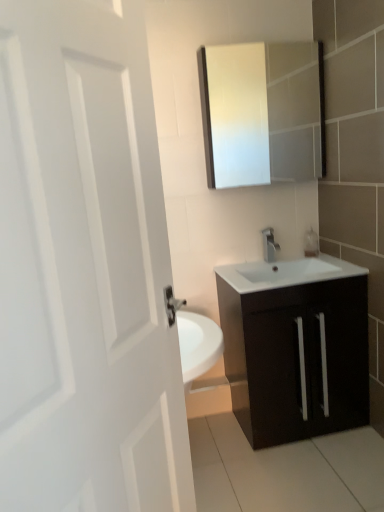
Question: From a real-world perspective, is matte dark wood cabinet at lower right beneath clear glass soap dispenser at right?

Choices:
 (A) no
 (B) yes

Answer: (B)

Question: Is matte dark wood cabinet at lower right thinner than clear glass soap dispenser at right?

Choices:
 (A) yes
 (B) no

Answer: (B)

Question: Is matte dark wood cabinet at lower right facing away from clear glass soap dispenser at right?

Choices:
 (A) yes
 (B) no

Answer: (B)

Question: Is matte dark wood cabinet at lower right surrounding clear glass soap dispenser at right?

Choices:
 (A) yes
 (B) no

Answer: (B)

Question: Can you confirm if matte dark wood cabinet at lower right is shorter than clear glass soap dispenser at right?

Choices:
 (A) yes
 (B) no

Answer: (B)

Question: From their relative heights in the image, would you say white matte door at left is taller or shorter than matte dark wood cabinet at lower right?

Choices:
 (A) tall
 (B) short

Answer: (A)

Question: From a real-world perspective, is white matte door at left positioned above or below matte dark wood cabinet at lower right?

Choices:
 (A) below
 (B) above

Answer: (B)

Question: From the image's perspective, is white matte door at left above or below matte dark wood cabinet at lower right?

Choices:
 (A) above
 (B) below

Answer: (A)

Question: Based on their positions, is white matte door at left located to the left or right of matte dark wood cabinet at lower right?

Choices:
 (A) right
 (B) left

Answer: (B)

Question: Visually, is white matte door at left positioned to the left or to the right of clear glass soap dispenser at right?

Choices:
 (A) left
 (B) right

Answer: (A)

Question: Is white matte door at left taller or shorter than clear glass soap dispenser at right?

Choices:
 (A) short
 (B) tall

Answer: (B)

Question: Considering the positions of white matte door at left and clear glass soap dispenser at right in the image, is white matte door at left wider or thinner than clear glass soap dispenser at right?

Choices:
 (A) wide
 (B) thin

Answer: (A)

Question: Considering their positions, is white matte door at left located in front of or behind clear glass soap dispenser at right?

Choices:
 (A) behind
 (B) front

Answer: (B)

Question: Considering the positions of point (240, 154) and point (291, 339), is point (240, 154) closer or farther from the camera than point (291, 339)?

Choices:
 (A) farther
 (B) closer

Answer: (A)

Question: Relative to matte dark wood cabinet at lower right, is white glossy medicine cabinet at upper center in front or behind?

Choices:
 (A) behind
 (B) front

Answer: (A)